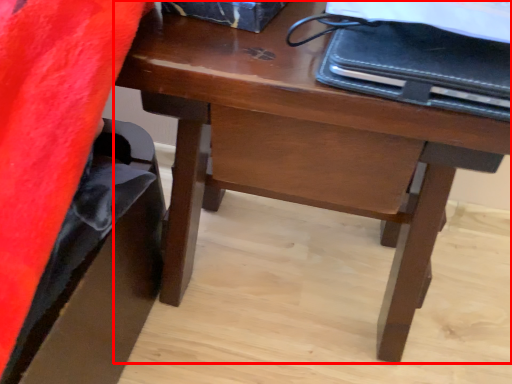
Question: From the image's perspective, what is the correct spatial relationship of desk (annotated by the red box) in relation to notebook?

Choices:
 (A) below
 (B) above

Answer: (A)